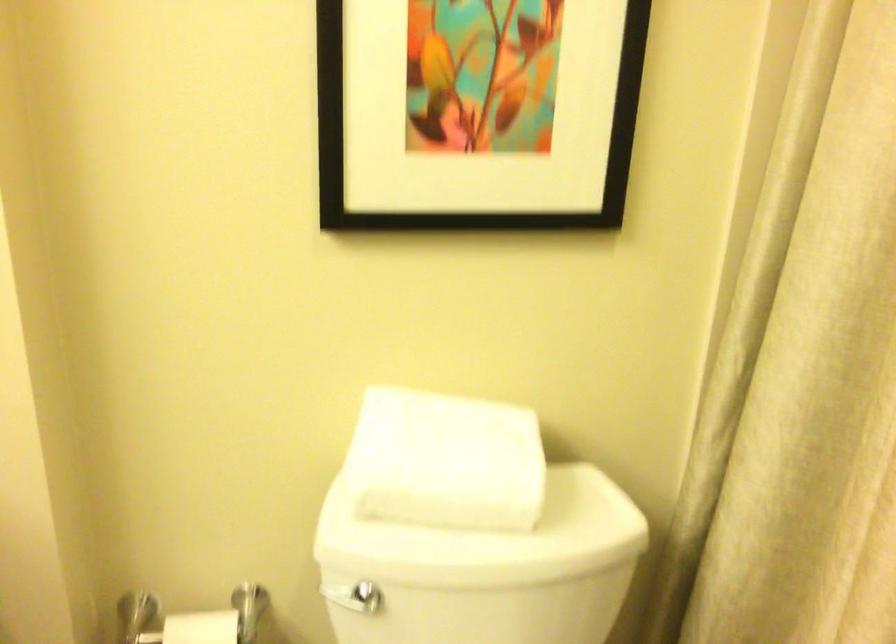
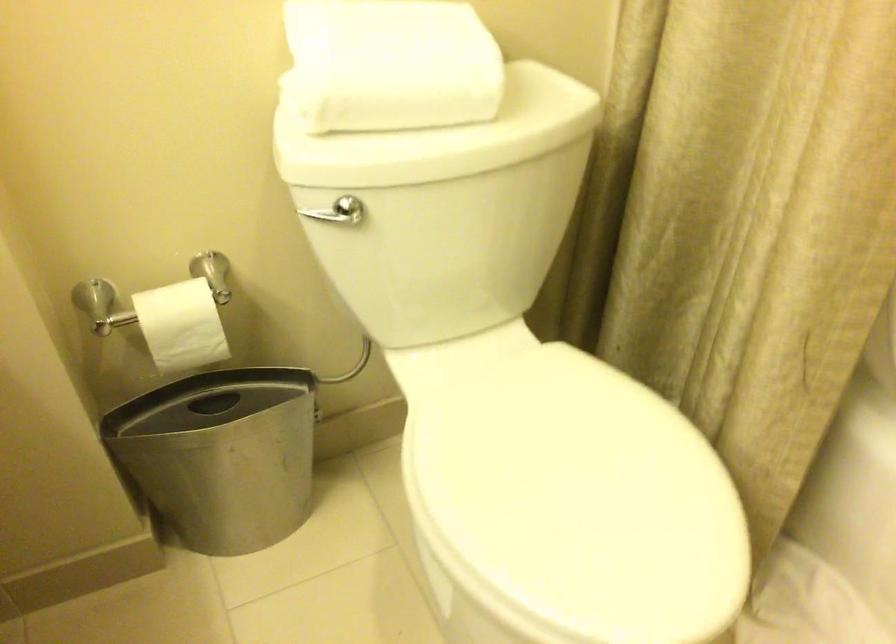
Question: The images are taken continuously from a first-person perspective. In which direction are you moving?

Choices:
 (A) Left
 (B) Right
 (C) Forward
 (D) Backward

Answer: (A)